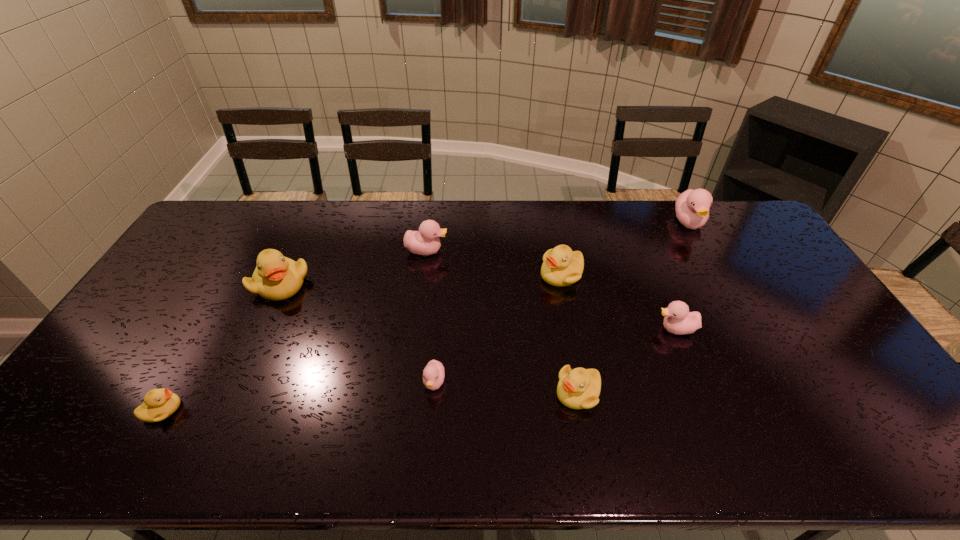
Locate an element on the screen. This screenshot has width=960, height=540. free point located 0.240m on the front-facing side of the second duckling from right to left is located at coordinates (572, 329).

This screenshot has width=960, height=540. Find the location of `free point located on the front-facing side of the third biggest yellow duckling`. free point located on the front-facing side of the third biggest yellow duckling is located at coordinates (406, 393).

You are a GUI agent. You are given a task and a screenshot of the screen. Output one action in this format:
    pyautogui.click(x=<x>, y=<y>)
    Task: Click on the vacant space situated on the front-facing side of the third biggest yellow duckling
    
    Given the screenshot: What is the action you would take?
    pyautogui.click(x=434, y=393)

Identify the location of vacant space located 0.070m on the front-facing side of the third biggest yellow duckling. (528, 393).

Locate an element on the screen. Image resolution: width=960 pixels, height=540 pixels. free space located on the front-facing side of the smallest pink duckling is located at coordinates (430, 428).

Find the location of a particular element. vacant space located 0.390m on the front-facing side of the smallest yellow duckling is located at coordinates (337, 410).

Identify the location of object present at the far edge. (692, 207).

At what (x,y) coordinates should I click in order to perform the action: click on vacant space at the far edge of the desktop. Please return your answer as a coordinate pair (x, y). The width and height of the screenshot is (960, 540). Looking at the image, I should click on (564, 202).

Locate an element on the screen. The height and width of the screenshot is (540, 960). vacant space at the near edge is located at coordinates (280, 461).

Image resolution: width=960 pixels, height=540 pixels. I want to click on vacant space at the left edge of the desktop, so click(200, 246).